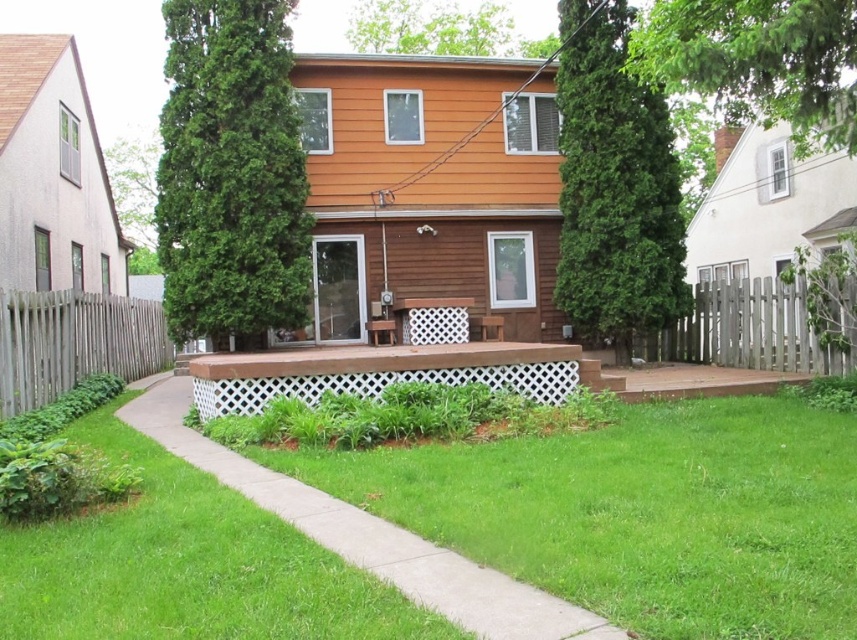
In the scene shown: You are designing a garden layout and need to know the relative sizes of the fences. Which fence is larger between the wooden picket fence at right and the gray wood fence at left?

The gray wood fence at left is larger than the wooden picket fence at right.

You are standing at the point with coordinates (x=367, y=534) in the residential backyard scene. What material are you standing on?

You are standing on concrete at center.